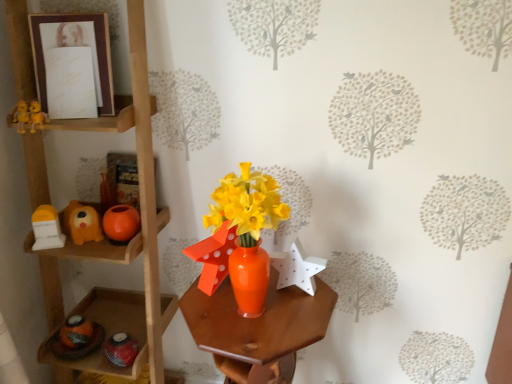
Where is `blank space to the left of white matte star at center, which is counted as the third toy, starting from the left`? The width and height of the screenshot is (512, 384). blank space to the left of white matte star at center, which is counted as the third toy, starting from the left is located at coordinates (234, 311).